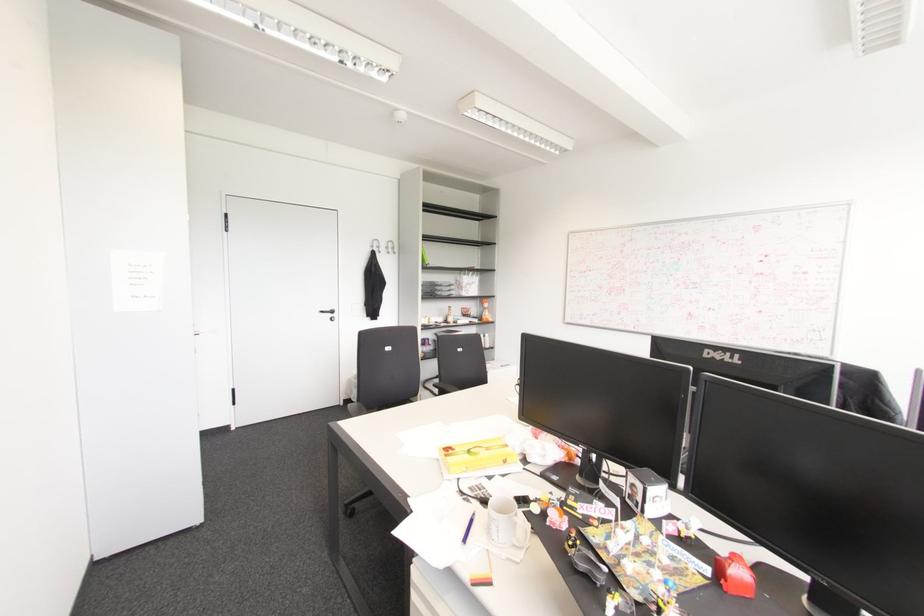
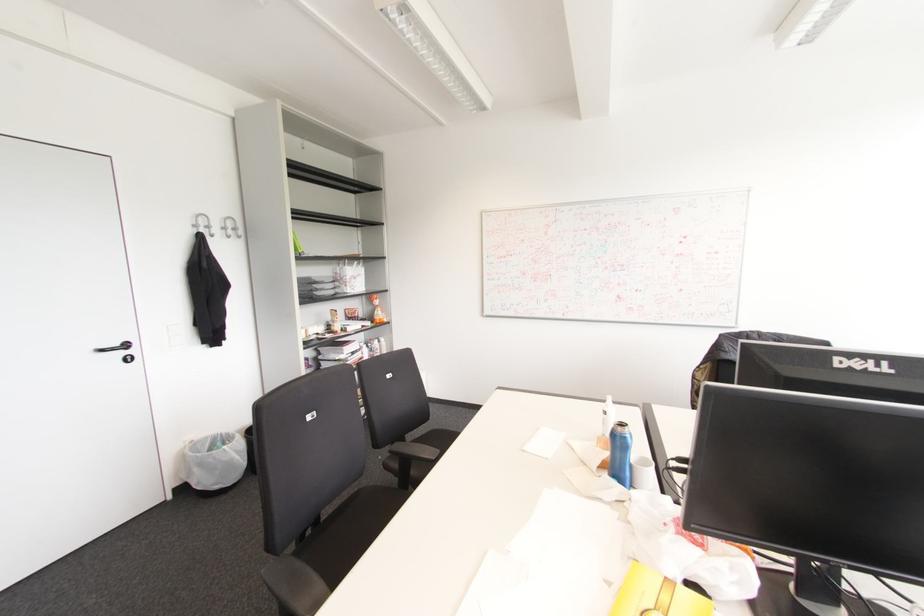
Find the pixel in the second image that matches (371,246) in the first image.

(195, 225)